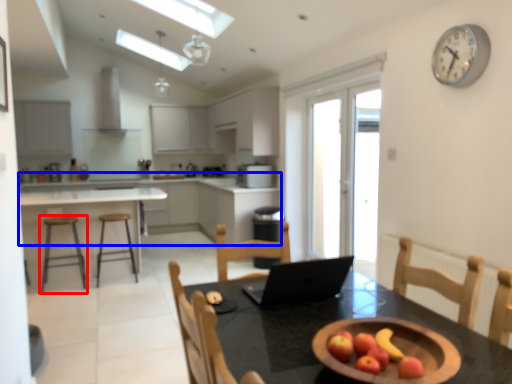
Question: Which object appears closest to the camera in this image, stool (highlighted by a red box) or cabinetry (highlighted by a blue box)?

Choices:
 (A) stool
 (B) cabinetry

Answer: (A)